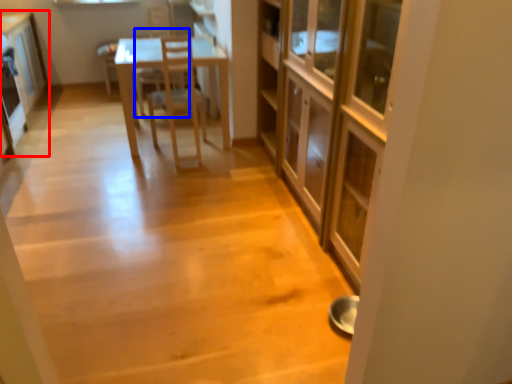
Question: Which object appears closest to the camera in this image, cabinetry (highlighted by a red box) or armchair (highlighted by a blue box)?

Choices:
 (A) cabinetry
 (B) armchair

Answer: (A)